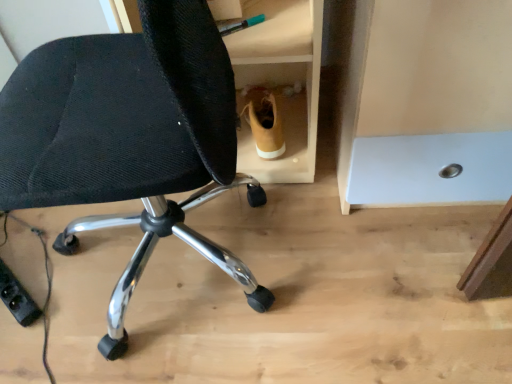
Image resolution: width=512 pixels, height=384 pixels. Describe the element at coordinates (264, 121) in the screenshot. I see `light brown leather boot at center` at that location.

Identify the location of light brown leather boot at center. (264, 121).

Describe the element at coordinates (128, 138) in the screenshot. This screenshot has height=384, width=512. I see `black mesh chair at lower left` at that location.

Identify the location of black mesh chair at lower left. The width and height of the screenshot is (512, 384). (128, 138).

Locate an element on the screen. The image size is (512, 384). light brown leather boot at center is located at coordinates (264, 121).

Considering the relative positions of black mesh chair at lower left and light brown leather boot at center in the image provided, is black mesh chair at lower left to the right of light brown leather boot at center from the viewer's perspective?

No.

Does black mesh chair at lower left come in front of light brown leather boot at center?

Yes, it is in front of light brown leather boot at center.

Is point (32, 64) more distant than point (253, 117)?

No, it is not.

From the image's perspective, is black mesh chair at lower left above light brown leather boot at center?

No, from the image's perspective, black mesh chair at lower left is not above light brown leather boot at center.

From a real-world perspective, which object rests below the other?

light brown leather boot at center, from a real-world perspective.

Which object is thinner, black mesh chair at lower left or light brown leather boot at center?

With smaller width is light brown leather boot at center.

Which of these two, black mesh chair at lower left or light brown leather boot at center, stands taller?

black mesh chair at lower left is taller.

Considering the sizes of objects black mesh chair at lower left and light brown leather boot at center in the image provided, who is bigger, black mesh chair at lower left or light brown leather boot at center?

With larger size is black mesh chair at lower left.

Is light brown leather boot at center surrounded by black mesh chair at lower left?

Actually, light brown leather boot at center is outside black mesh chair at lower left.

Would you consider black mesh chair at lower left to be distant from light brown leather boot at center?

No, there isn't a large distance between black mesh chair at lower left and light brown leather boot at center.

Could you tell me if black mesh chair at lower left is turned towards light brown leather boot at center?

No.

How distant is black mesh chair at lower left from light brown leather boot at center?

20.49 inches.

Where is `footwear behind the black mesh chair at lower left`? Image resolution: width=512 pixels, height=384 pixels. footwear behind the black mesh chair at lower left is located at coordinates (264, 121).

Can you confirm if light brown leather boot at center is positioned to the left of black mesh chair at lower left?

No.

Is the position of light brown leather boot at center less distant than that of black mesh chair at lower left?

No, light brown leather boot at center is behind black mesh chair at lower left.

Is point (244, 96) farther from viewer compared to point (60, 49)?

Yes, point (244, 96) is behind point (60, 49).

From the image's perspective, would you say light brown leather boot at center is positioned over black mesh chair at lower left?

Correct, light brown leather boot at center appears higher than black mesh chair at lower left in the image.

From a real-world perspective, is light brown leather boot at center under black mesh chair at lower left?

Correct, in the physical world, light brown leather boot at center is lower than black mesh chair at lower left.

Which of these two, light brown leather boot at center or black mesh chair at lower left, is wider?

black mesh chair at lower left.

Considering the sizes of objects light brown leather boot at center and black mesh chair at lower left in the image provided, who is shorter, light brown leather boot at center or black mesh chair at lower left?

light brown leather boot at center.

Looking at the image, does light brown leather boot at center seem bigger or smaller compared to black mesh chair at lower left?

In the image, light brown leather boot at center appears to be smaller than black mesh chair at lower left.

Is light brown leather boot at center inside the boundaries of black mesh chair at lower left, or outside?

light brown leather boot at center is not inside black mesh chair at lower left, it's outside.

From the picture: Are light brown leather boot at center and black mesh chair at lower left beside each other?

No, light brown leather boot at center is not with black mesh chair at lower left.

Is light brown leather boot at center positioned with its back to black mesh chair at lower left?

No, black mesh chair at lower left is not at the back of light brown leather boot at center.

What's the angular difference between light brown leather boot at center and black mesh chair at lower left's facing directions?

The angular difference between light brown leather boot at center and black mesh chair at lower left is 100 degrees.

Find the location of a particular element. Image resolution: width=512 pixels, height=384 pixels. chair in front of the light brown leather boot at center is located at coordinates (128, 138).

Where is `chair in front of the light brown leather boot at center`? chair in front of the light brown leather boot at center is located at coordinates (128, 138).

Locate an element on the screen. This screenshot has width=512, height=384. footwear behind the black mesh chair at lower left is located at coordinates (264, 121).